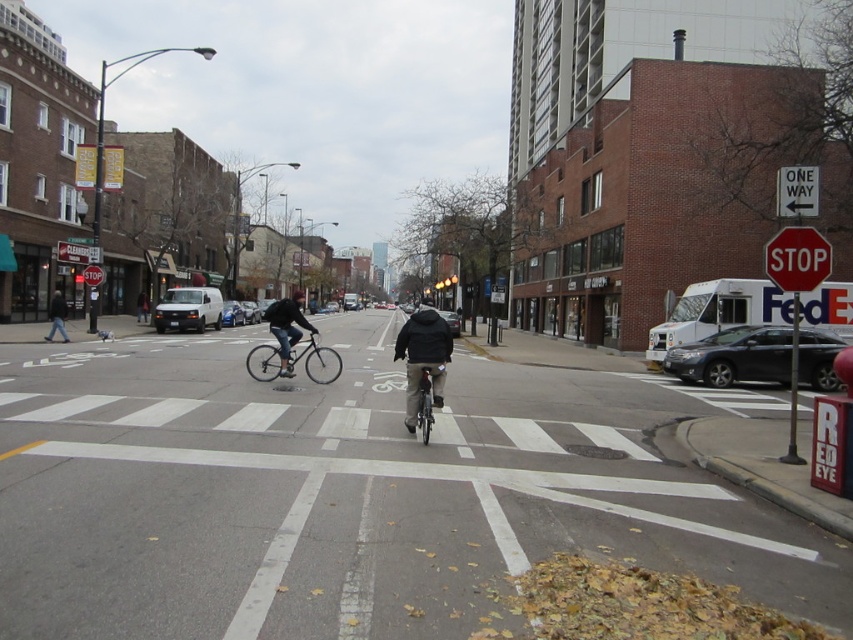
You are a pedestrian standing at the crosswalk and see the matte black jacket at center and the silver metallic sedan at center. Which object takes up more space in the image?

The matte black jacket at center has a larger size compared to the silver metallic sedan at center, so it takes up more space in the image.